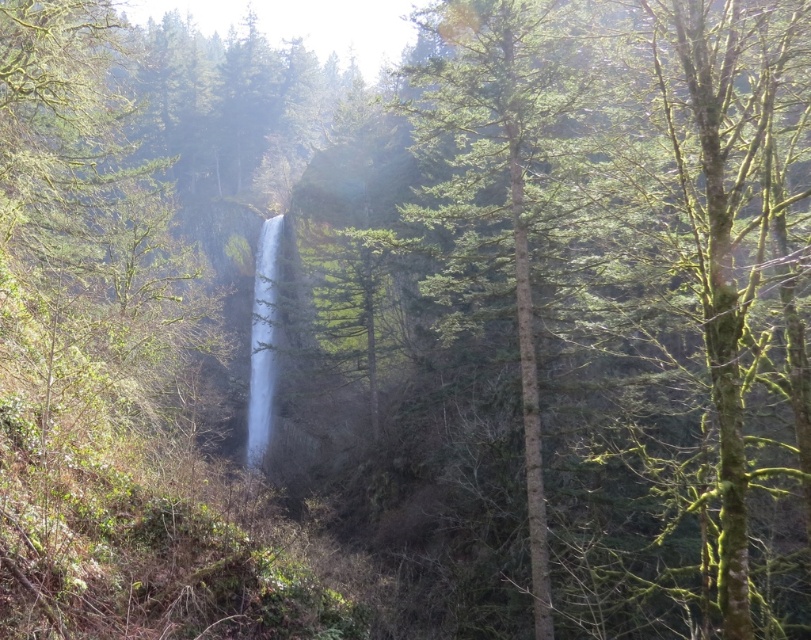
Based on the photo, you are standing at the base of the waterfall in the image and want to reach a specific point. You notice two points marked in the scene. Which point, point (550, 602) or point (258, 358), is closer to you?

Point (550, 602) is closer to you because it is in front of point (258, 358).

You are a hiker standing at the edge of the cliff overlooking the waterfall. You notice the green textured tree at center and the clear water at center. How far apart are these two landmarks from your current position?

The green textured tree at center is 54.93 feet away from the clear water at center.

You are a hiker standing at the edge of the cliff overlooking the waterfall. You notice a green textured tree at center and clear water at center. Which object is closer to you?

The green textured tree at center is closer to you as it is positioned in front of the clear water at center.